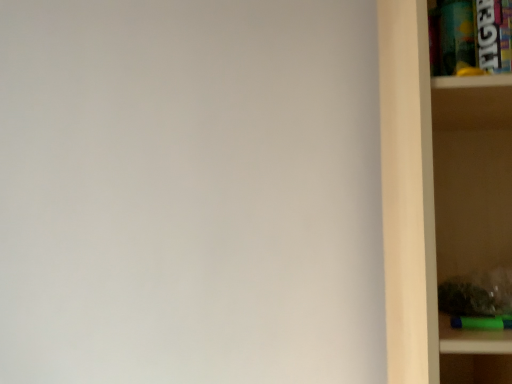
Question: Can you confirm if metallic plastic cabinet at upper right is positioned to the right of wooden shelf at right?

Choices:
 (A) no
 (B) yes

Answer: (A)

Question: Is wooden shelf at right located within metallic plastic cabinet at upper right?

Choices:
 (A) no
 (B) yes

Answer: (A)

Question: From the image's perspective, is metallic plastic cabinet at upper right on top of wooden shelf at right?

Choices:
 (A) yes
 (B) no

Answer: (A)

Question: Is metallic plastic cabinet at upper right wider than wooden shelf at right?

Choices:
 (A) no
 (B) yes

Answer: (A)

Question: Does metallic plastic cabinet at upper right have a larger size compared to wooden shelf at right?

Choices:
 (A) yes
 (B) no

Answer: (B)

Question: Is metallic plastic cabinet at upper right not near wooden shelf at right?

Choices:
 (A) yes
 (B) no

Answer: (B)

Question: From a real-world perspective, is wooden shelf at right physically above metallic plastic cabinet at upper right?

Choices:
 (A) yes
 (B) no

Answer: (B)

Question: Does wooden shelf at right come in front of metallic plastic cabinet at upper right?

Choices:
 (A) yes
 (B) no

Answer: (A)

Question: Can you confirm if wooden shelf at right is shorter than metallic plastic cabinet at upper right?

Choices:
 (A) yes
 (B) no

Answer: (B)

Question: Does wooden shelf at right have a larger size compared to metallic plastic cabinet at upper right?

Choices:
 (A) no
 (B) yes

Answer: (B)

Question: Is metallic plastic cabinet at upper right inside wooden shelf at right?

Choices:
 (A) no
 (B) yes

Answer: (B)

Question: Can you confirm if wooden shelf at right is smaller than metallic plastic cabinet at upper right?

Choices:
 (A) yes
 (B) no

Answer: (B)

Question: From a real-world perspective, relative to metallic plastic cabinet at upper right, is wooden shelf at right vertically above or below?

Choices:
 (A) above
 (B) below

Answer: (B)